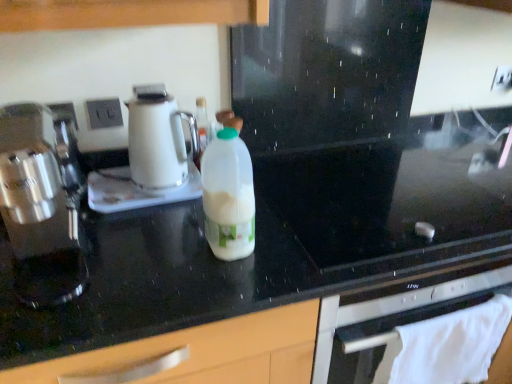
Where is `vacant area located to the right-hand side of white plastic bottle at center`? Image resolution: width=512 pixels, height=384 pixels. vacant area located to the right-hand side of white plastic bottle at center is located at coordinates (285, 249).